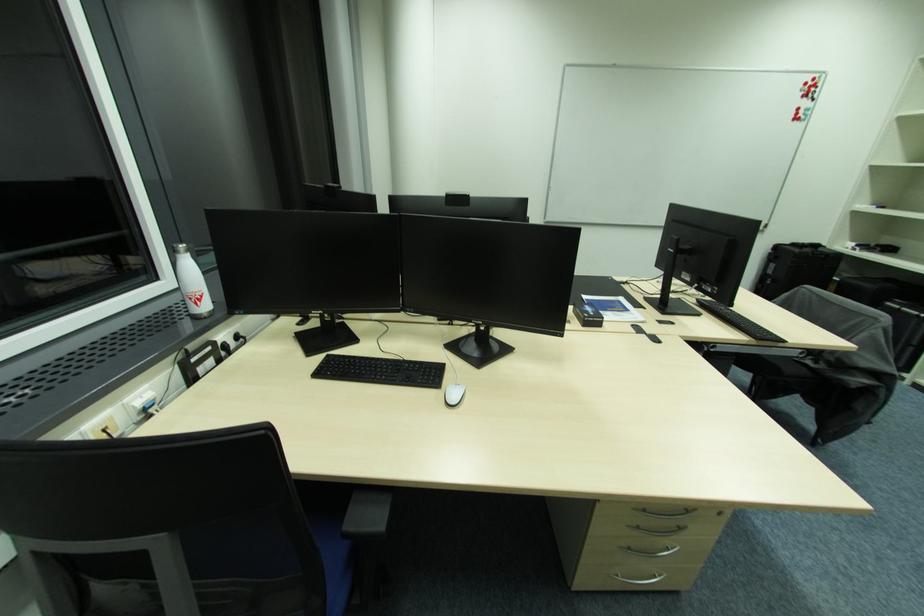
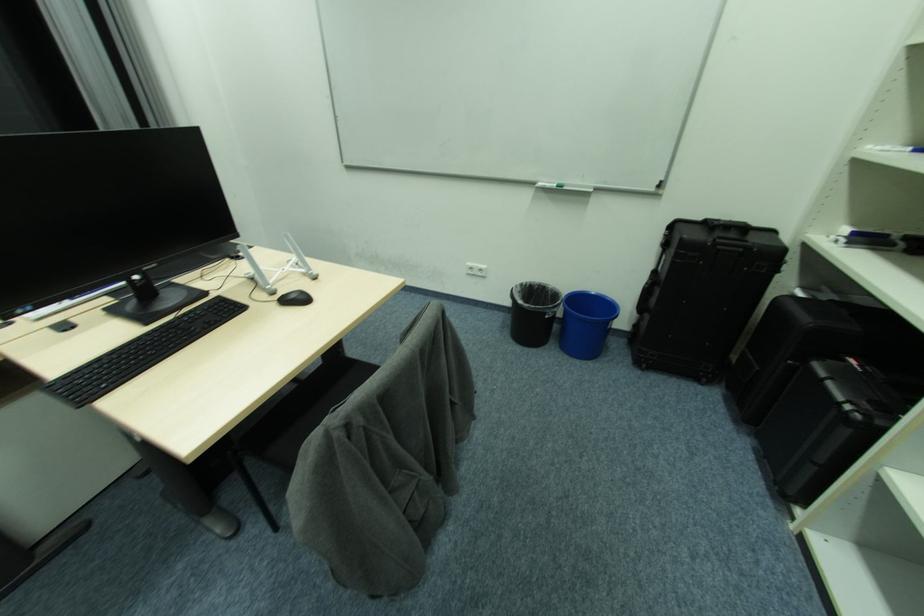
Based on the photo, in a continuous first-person perspective shot, in which direction is the camera moving?

The cameraman moved toward right, forward.